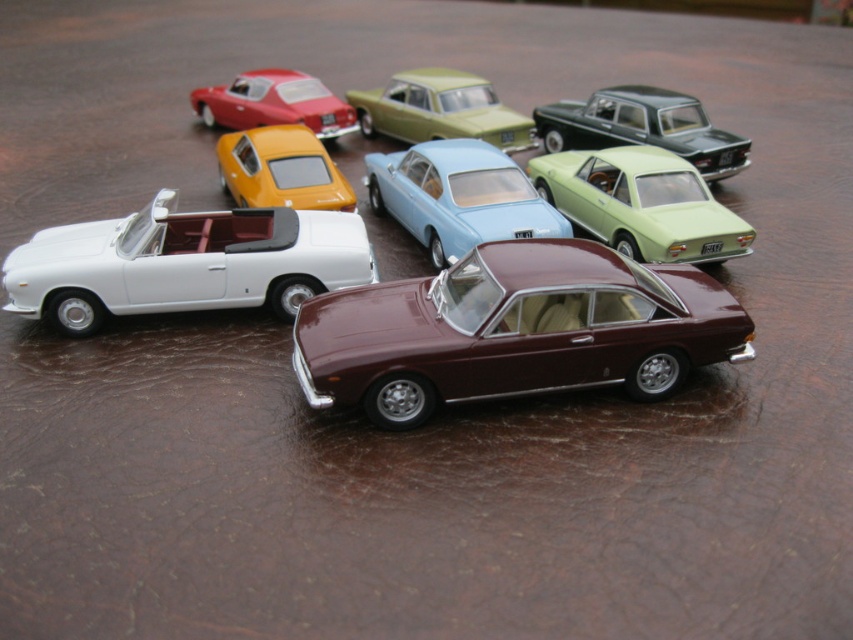
Question: Can you confirm if white matte convertible at left is bigger than metallic green station wagon at upper center?

Choices:
 (A) no
 (B) yes

Answer: (A)

Question: Which point is closer to the camera?

Choices:
 (A) (425, 93)
 (B) (740, 237)
 (C) (635, 96)

Answer: (B)

Question: Is metallic green station wagon at upper center closer to camera compared to matte red car at upper left?

Choices:
 (A) yes
 (B) no

Answer: (A)

Question: Which object appears closest to the camera in this image?

Choices:
 (A) matte green car at center
 (B) matte red car at upper left

Answer: (A)

Question: Among these points, which one is nearest to the camera?

Choices:
 (A) (712, 330)
 (B) (225, 189)

Answer: (A)

Question: Is white matte convertible at left to the left of matte green car at center from the viewer's perspective?

Choices:
 (A) yes
 (B) no

Answer: (A)